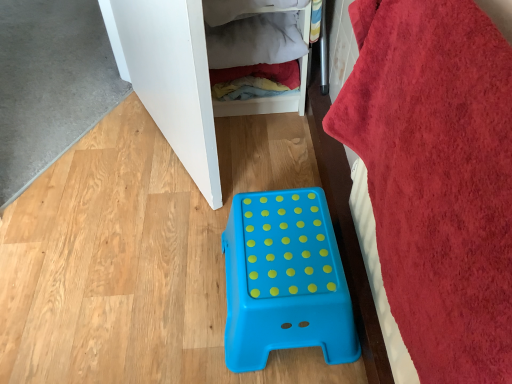
Question: Can you confirm if white matte cabinet at upper left, acting as the second furniture starting from the bottom, is positioned to the right of red plush bath towel at right?

Choices:
 (A) yes
 (B) no

Answer: (B)

Question: Is white matte cabinet at upper left, marked as the first furniture in a left-to-right arrangement, to the left of red plush bath towel at right from the viewer's perspective?

Choices:
 (A) no
 (B) yes

Answer: (B)

Question: Is white matte cabinet at upper left, acting as the first furniture starting from the top, oriented away from red plush bath towel at right?

Choices:
 (A) no
 (B) yes

Answer: (A)

Question: Considering the relative sizes of white matte cabinet at upper left, marked as the first furniture in a left-to-right arrangement, and red plush bath towel at right in the image provided, is white matte cabinet at upper left, marked as the first furniture in a left-to-right arrangement, smaller than red plush bath towel at right?

Choices:
 (A) no
 (B) yes

Answer: (A)

Question: Can you confirm if white matte cabinet at upper left, acting as the first furniture starting from the top, is thinner than red plush bath towel at right?

Choices:
 (A) no
 (B) yes

Answer: (A)

Question: Considering the relative sizes of white matte cabinet at upper left, marked as the first furniture in a left-to-right arrangement, and red plush bath towel at right in the image provided, is white matte cabinet at upper left, marked as the first furniture in a left-to-right arrangement, wider than red plush bath towel at right?

Choices:
 (A) yes
 (B) no

Answer: (A)

Question: Is wooden/textured clothes at upper center wider than white matte cabinet at upper left, marked as the first furniture in a left-to-right arrangement?

Choices:
 (A) no
 (B) yes

Answer: (B)

Question: Is wooden/textured clothes at upper center touching white matte cabinet at upper left, marked as the first furniture in a left-to-right arrangement?

Choices:
 (A) no
 (B) yes

Answer: (A)

Question: From the image's perspective, is wooden/textured clothes at upper center beneath white matte cabinet at upper left, placed as the second furniture when sorted from right to left?

Choices:
 (A) no
 (B) yes

Answer: (A)

Question: Considering the relative sizes of wooden/textured clothes at upper center and white matte cabinet at upper left, placed as the second furniture when sorted from right to left, in the image provided, is wooden/textured clothes at upper center thinner than white matte cabinet at upper left, placed as the second furniture when sorted from right to left,?

Choices:
 (A) yes
 (B) no

Answer: (B)

Question: Can you confirm if wooden/textured clothes at upper center is smaller than white matte cabinet at upper left, marked as the first furniture in a left-to-right arrangement?

Choices:
 (A) yes
 (B) no

Answer: (A)

Question: Is white matte cabinet at upper left, placed as the second furniture when sorted from right to left, inside wooden/textured clothes at upper center?

Choices:
 (A) yes
 (B) no

Answer: (B)

Question: Does blue plastic step stool at center, the first furniture when ordered from bottom to top, have a lesser width compared to wooden/textured clothes at upper center?

Choices:
 (A) yes
 (B) no

Answer: (B)